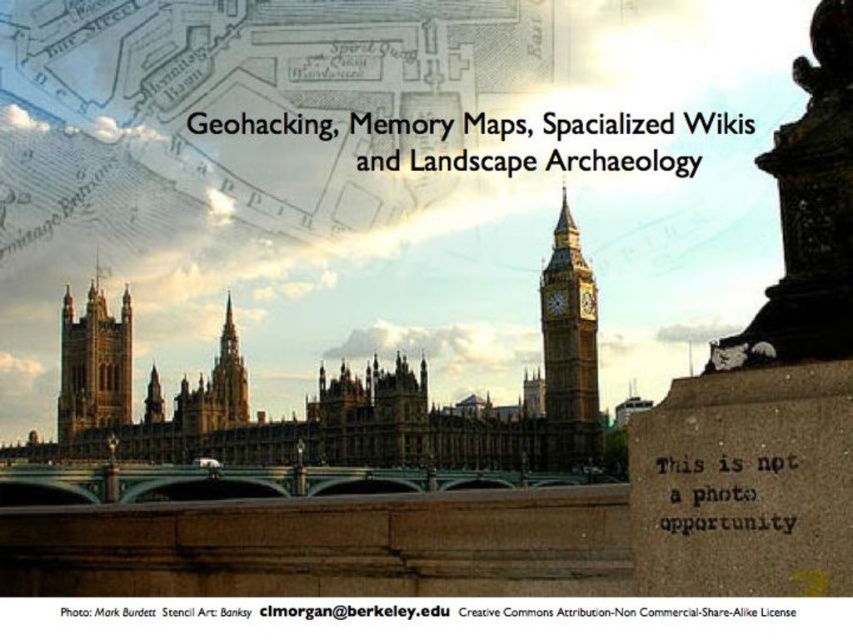
Which of these two, gold-plated clock tower at center-right or matte gold clock at center right, stands shorter?

Standing shorter between the two is matte gold clock at center right.

Between gold-plated clock tower at center-right and matte gold clock at center right, which one is positioned lower?

gold-plated clock tower at center-right is lower down.

Find the location of a particular element. Image resolution: width=853 pixels, height=640 pixels. gold-plated clock tower at center-right is located at coordinates (567, 355).

Is golden stone palace at center to the left of dark gray stone statue at upper right from the viewer's perspective?

Correct, you'll find golden stone palace at center to the left of dark gray stone statue at upper right.

Image resolution: width=853 pixels, height=640 pixels. What are the coordinates of `golden stone palace at center` in the screenshot? It's located at (328, 401).

Where is `golden stone palace at center`? Image resolution: width=853 pixels, height=640 pixels. golden stone palace at center is located at coordinates (328, 401).

In order to click on golden stone palace at center in this screenshot , I will do `click(328, 401)`.

The height and width of the screenshot is (640, 853). I want to click on golden stone palace at center, so click(328, 401).

Does golden stone palace at center appear on the left side of red brick tower at left?

Incorrect, golden stone palace at center is not on the left side of red brick tower at left.

Between point (292, 452) and point (86, 410), which one is positioned behind?

The point (86, 410) is behind.

Where is `golden stone palace at center`? golden stone palace at center is located at coordinates (328, 401).